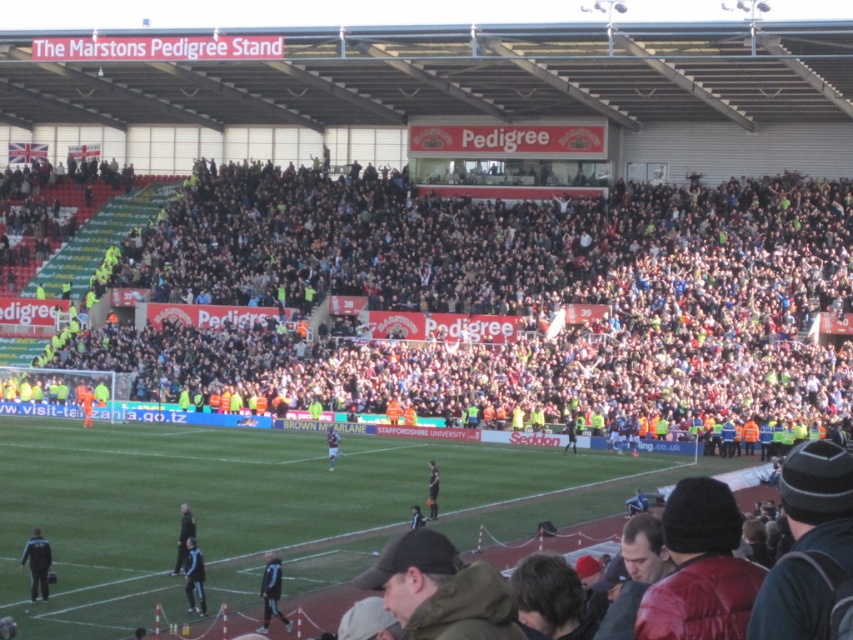
You are a photographer positioned at the edge of the football stadium, aiming to capture a closeup shot of the blue fabric jacket at lower left. Given that your camera has a maximum zoom range of 35 meters, will you be able to get a clear closeup of the jacket?

The blue fabric jacket at lower left is 40.33 meters away from the viewer, which exceeds the camera maximum zoom range of 35 meters. Therefore, you won not be able to get a clear closeup of the jacket.

You are a photographer at the stadium and want to capture both the blue fabric jacket at lower left and the dark gray jacket at lower center in a single frame. Based on their sizes, which jacket would appear smaller in the photo?

The blue fabric jacket at lower left occupies less space than the dark gray jacket at lower center, so it would appear smaller in the photo.